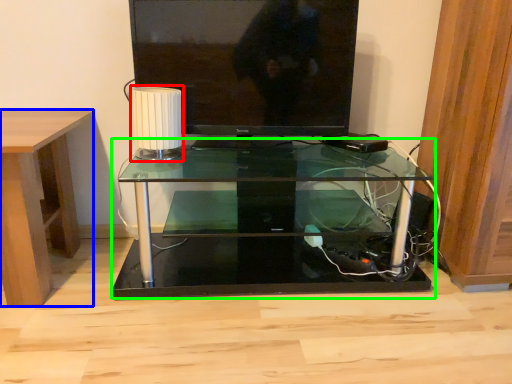
Question: Considering the real-world distances, which object is farthest from lamp (highlighted by a red box)? desk (highlighted by a blue box) or table (highlighted by a green box)?

Choices:
 (A) desk
 (B) table

Answer: (B)